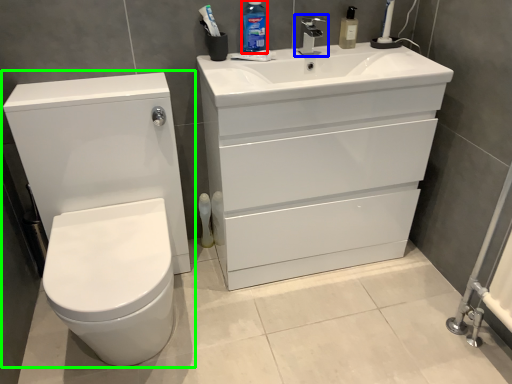
Question: Which object is positioned farthest from cleaning product (highlighted by a red box)? Select from tap (highlighted by a blue box) and toilet (highlighted by a green box).

Choices:
 (A) tap
 (B) toilet

Answer: (B)